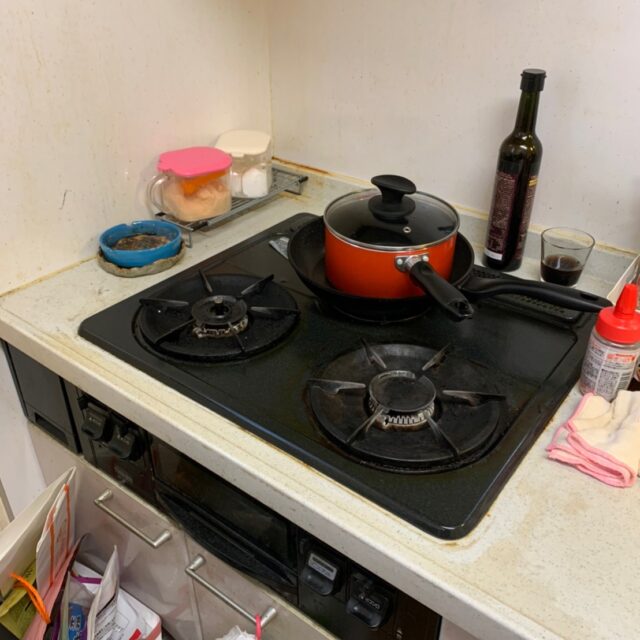
At what (x,y) coordinates should I click in order to perform the action: click on wall. Please return your answer as a coordinate pair (x, y). Looking at the image, I should click on (129, 74).